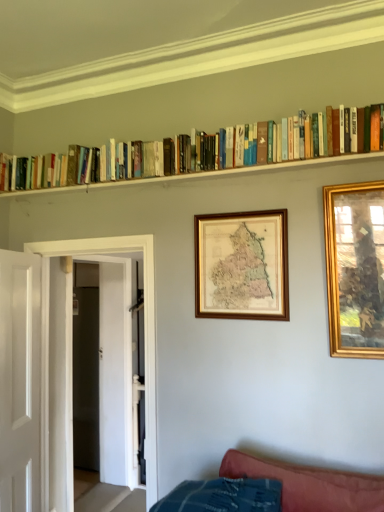
Question: Considering the relative sizes of hardcover books at upper center and white smooth door at left, the 1th door positioned from the front, in the image provided, is hardcover books at upper center taller than white smooth door at left, the 1th door positioned from the front,?

Choices:
 (A) yes
 (B) no

Answer: (B)

Question: Can you confirm if hardcover books at upper center is smaller than white smooth door at left, the 1th door positioned from the front?

Choices:
 (A) yes
 (B) no

Answer: (A)

Question: Is hardcover books at upper center in front of white smooth door at left, acting as the 2th door starting from the back?

Choices:
 (A) no
 (B) yes

Answer: (B)

Question: Considering the relative sizes of hardcover books at upper center and white smooth door at left, acting as the 2th door starting from the back, in the image provided, is hardcover books at upper center thinner than white smooth door at left, acting as the 2th door starting from the back,?

Choices:
 (A) no
 (B) yes

Answer: (B)

Question: Can we say hardcover books at upper center lies outside white smooth door at left, acting as the 2th door starting from the back?

Choices:
 (A) yes
 (B) no

Answer: (A)

Question: Is white glossy door at left, the first door from the back, situated inside wooden books at upper center or outside?

Choices:
 (A) outside
 (B) inside

Answer: (A)

Question: In the image, is white glossy door at left, the 2th door from the front, positioned in front of or behind wooden books at upper center?

Choices:
 (A) front
 (B) behind

Answer: (B)

Question: Is point (46, 332) closer or farther from the camera than point (178, 180)?

Choices:
 (A) closer
 (B) farther

Answer: (B)

Question: In terms of height, does white glossy door at left, the 2th door from the front, look taller or shorter compared to wooden books at upper center?

Choices:
 (A) short
 (B) tall

Answer: (B)

Question: From their relative heights in the image, would you say hardcover books at upper center is taller or shorter than white glossy door at left, the 2th door from the front?

Choices:
 (A) short
 (B) tall

Answer: (A)

Question: Relative to white glossy door at left, the 2th door from the front, is hardcover books at upper center in front or behind?

Choices:
 (A) behind
 (B) front

Answer: (B)

Question: From the image's perspective, relative to white glossy door at left, the first door from the back, is hardcover books at upper center above or below?

Choices:
 (A) above
 (B) below

Answer: (A)

Question: In the image, is hardcover books at upper center on the left side or the right side of white glossy door at left, the 2th door from the front?

Choices:
 (A) left
 (B) right

Answer: (B)

Question: In the image, is white glossy door at left, the first door from the back, positioned in front of or behind gold-framed picture at right, positioned as the second picture frame in back-to-front order?

Choices:
 (A) behind
 (B) front

Answer: (A)

Question: Do you think white glossy door at left, the 2th door from the front, is within gold-framed picture at right, the 1th picture frame positioned from the right, or outside of it?

Choices:
 (A) outside
 (B) inside

Answer: (A)